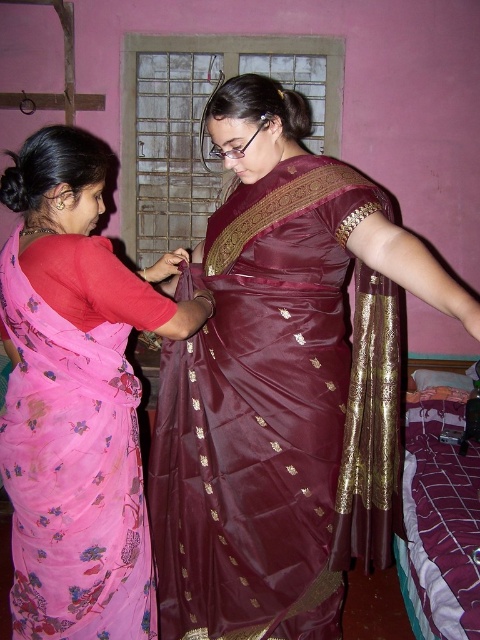
Question: Does maroon satin saree at center appear on the right side of gold silk saree at center?

Choices:
 (A) no
 (B) yes

Answer: (A)

Question: Does maroon satin saree at center appear on the left side of gold silk saree at center?

Choices:
 (A) no
 (B) yes

Answer: (B)

Question: Which of the following is the closest to the observer?

Choices:
 (A) gold silk saree at center
 (B) maroon satin saree at center

Answer: (B)

Question: Which of the following is the farthest from the observer?

Choices:
 (A) gold silk saree at center
 (B) floral chiffon sari at left

Answer: (A)

Question: Which object is the closest to the floral chiffon sari at left?

Choices:
 (A) maroon satin saree at center
 (B) gold silk saree at center

Answer: (A)

Question: Is maroon satin saree at center closer to camera compared to gold silk saree at center?

Choices:
 (A) yes
 (B) no

Answer: (A)